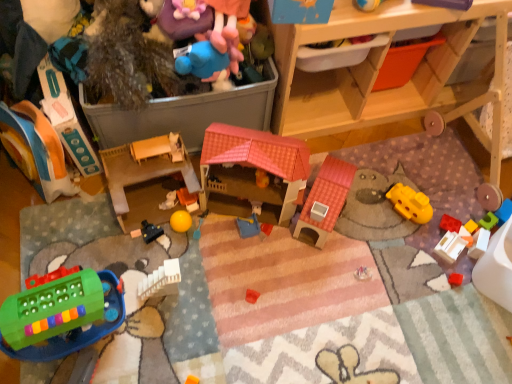
The image size is (512, 384). Identify the location of spots to the right of smooth orange ball at center, which is the seventh toy in right-to-left order. (226, 218).